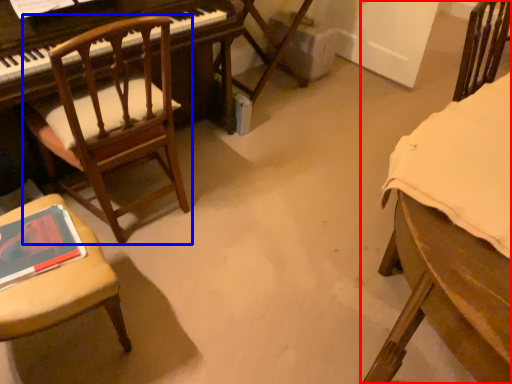
Question: Which point is closer to the camera, chair (highlighted by a red box) or chair (highlighted by a blue box)?

Choices:
 (A) chair
 (B) chair

Answer: (A)